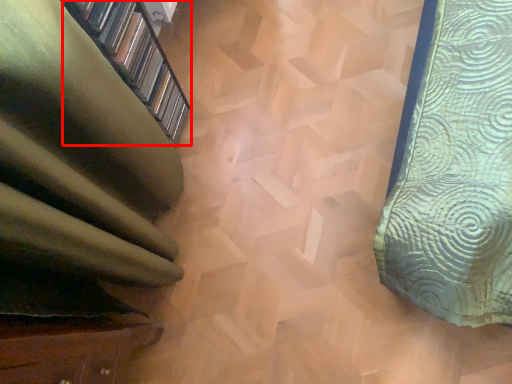
Question: From the image's perspective, where is shelf (annotated by the red box) located relative to stairwell?

Choices:
 (A) above
 (B) below

Answer: (A)